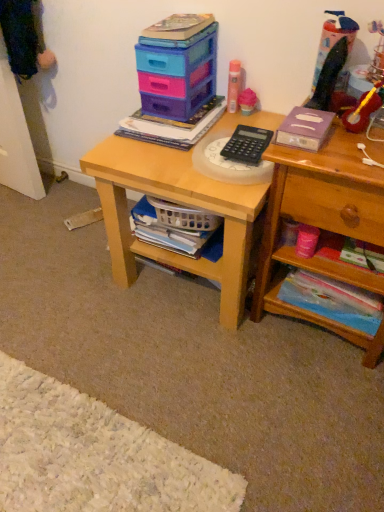
Locate an element on the screen. This screenshot has height=512, width=384. free space in front of pink matte spray can at upper center, positioned as the first toy in left-to-right order is located at coordinates pos(228,123).